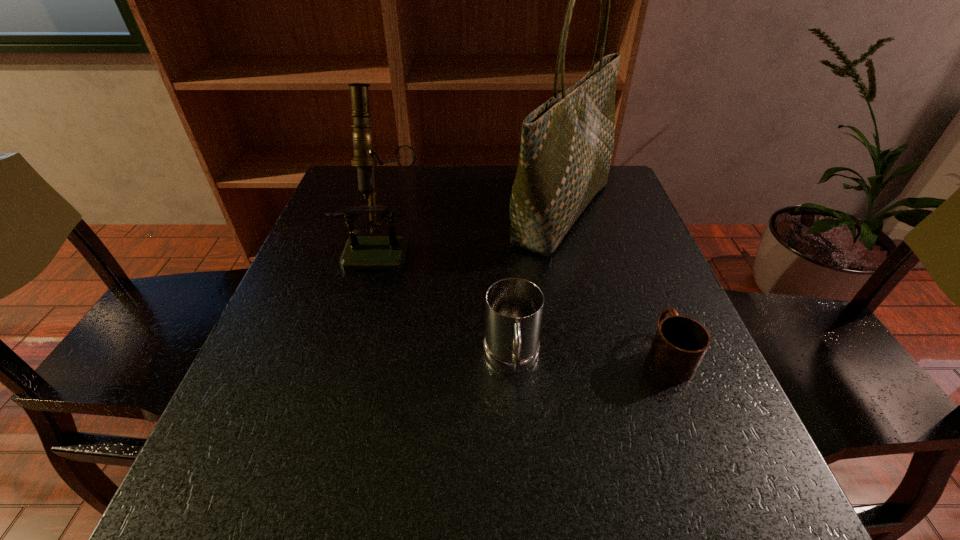
At what (x,y) coordinates should I click in order to perform the action: click on the tallest object. Please return your answer as a coordinate pair (x, y). The image size is (960, 540). Looking at the image, I should click on (567, 143).

The image size is (960, 540). In order to click on the leftmost object in this screenshot , I will do `click(390, 252)`.

Locate an element on the screen. The image size is (960, 540). the second tallest object is located at coordinates (390, 252).

Locate an element on the screen. the taller mug is located at coordinates (514, 306).

Locate an element on the screen. The width and height of the screenshot is (960, 540). the left mug is located at coordinates (514, 306).

Identify the location of the right mug. tap(680, 343).

You are a GUI agent. You are given a task and a screenshot of the screen. Output one action in this format:
    pyautogui.click(x=<x>, y=<y>)
    Task: Click on the shortest object
    This screenshot has width=960, height=540.
    Given the screenshot: What is the action you would take?
    pyautogui.click(x=680, y=343)

Find the location of a particular element. The height and width of the screenshot is (540, 960). vacant space situated on the left of the tallest object is located at coordinates (420, 211).

Image resolution: width=960 pixels, height=540 pixels. I want to click on vacant area situated at the eyepiece of the microscope, so click(x=366, y=322).

Locate an element on the screen. free region located on the side of the taller mug with the handle is located at coordinates click(520, 490).